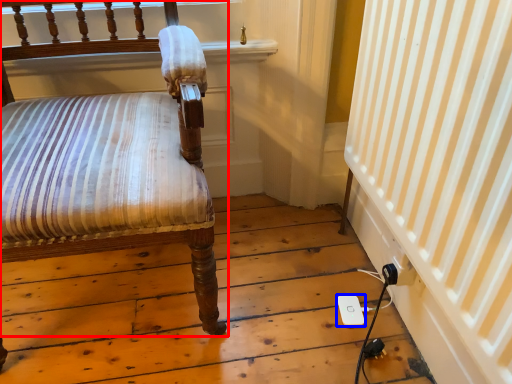
Question: Which object appears farthest to the camera in this image, chair (highlighted by a red box) or ipod (highlighted by a blue box)?

Choices:
 (A) chair
 (B) ipod

Answer: (B)